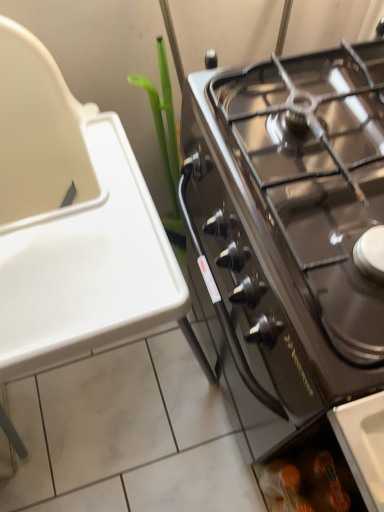
Locate an element on the screen. The height and width of the screenshot is (512, 384). green plastic plant at upper left is located at coordinates (165, 141).

Does point (172, 169) appear closer or farther from the camera than point (250, 275)?

Point (172, 169).

In the scene shown: Is green plastic plant at upper left in front of black glass gas stove at right?

No, green plastic plant at upper left is further to the viewer.

Does green plastic plant at upper left appear on the right side of black glass gas stove at right?

No.

Between black glass gas stove at right and translucent plastic bag at lower right, which one has smaller size?

translucent plastic bag at lower right is smaller.

Which point is more distant from viewer, (x=326, y=51) or (x=305, y=451)?

Point (x=305, y=451)

Which is correct: black glass gas stove at right is inside translucent plastic bag at lower right, or outside of it?

black glass gas stove at right is not inside translucent plastic bag at lower right, it's outside.

Is black glass gas stove at right looking in the opposite direction of translucent plastic bag at lower right?

No.

Find the location of a particular element. gas stove below the green plastic plant at upper left (from the image's perspective) is located at coordinates (288, 229).

Can you confirm if black glass gas stove at right is taller than green plastic plant at upper left?

No.

Is black glass gas stove at right positioned in front of green plastic plant at upper left?

Yes, it is.

Is black glass gas stove at right facing away from green plastic plant at upper left?

black glass gas stove at right does not have its back to green plastic plant at upper left.

Can you confirm if translucent plastic bag at lower right is taller than green plastic plant at upper left?

In fact, translucent plastic bag at lower right may be shorter than green plastic plant at upper left.

From the picture: Is translucent plastic bag at lower right not inside green plastic plant at upper left?

Yes.

Between translucent plastic bag at lower right and green plastic plant at upper left, which one has larger width?

green plastic plant at upper left.

From a real-world perspective, is translucent plastic bag at lower right positioned above or below green plastic plant at upper left?

From a real-world perspective, translucent plastic bag at lower right is physically below green plastic plant at upper left.

Find the location of a particular element. food below the green plastic plant at upper left (from the image's perspective) is located at coordinates (304, 484).

Does green plastic plant at upper left have a larger size compared to translucent plastic bag at lower right?

Correct, green plastic plant at upper left is larger in size than translucent plastic bag at lower right.

How different are the orientations of green plastic plant at upper left and translucent plastic bag at lower right in degrees?

44.8 degrees.

In terms of width, does green plastic plant at upper left look wider or thinner when compared to translucent plastic bag at lower right?

In the image, green plastic plant at upper left appears to be wider than translucent plastic bag at lower right.

Is point (309, 486) in front of point (281, 422)?

No, it is not.

Is translucent plastic bag at lower right in contact with black glass gas stove at right?

There is a gap between translucent plastic bag at lower right and black glass gas stove at right.

From the image's perspective, between translucent plastic bag at lower right and black glass gas stove at right, which one is located above?

black glass gas stove at right appears higher in the image.

Where is `gas stove in front of the green plastic plant at upper left`? This screenshot has width=384, height=512. gas stove in front of the green plastic plant at upper left is located at coordinates (288, 229).

Image resolution: width=384 pixels, height=512 pixels. In order to click on gas stove above the translucent plastic bag at lower right (from the image's perspective) in this screenshot , I will do `click(288, 229)`.

From the image, which object appears to be farther from green plastic plant at upper left, translucent plastic bag at lower right or black glass gas stove at right?

Among the two, translucent plastic bag at lower right is located further to green plastic plant at upper left.

Considering their positions, is green plastic plant at upper left positioned closer to translucent plastic bag at lower right than black glass gas stove at right?

Based on the image, black glass gas stove at right appears to be nearer to translucent plastic bag at lower right.

Looking at the image, which one is located closer to translucent plastic bag at lower right, black glass gas stove at right or green plastic plant at upper left?

black glass gas stove at right.

When comparing their distances from black glass gas stove at right, does green plastic plant at upper left or translucent plastic bag at lower right seem closer?

Based on the image, green plastic plant at upper left appears to be nearer to black glass gas stove at right.

Looking at the image, which one is located further to black glass gas stove at right, translucent plastic bag at lower right or green plastic plant at upper left?

translucent plastic bag at lower right.

From the image, which object appears to be farther from green plastic plant at upper left, black glass gas stove at right or translucent plastic bag at lower right?

translucent plastic bag at lower right is positioned further to the anchor green plastic plant at upper left.

This screenshot has width=384, height=512. What are the coordinates of `gas stove between green plastic plant at upper left and translucent plastic bag at lower right in the up-down direction` in the screenshot? It's located at (288, 229).